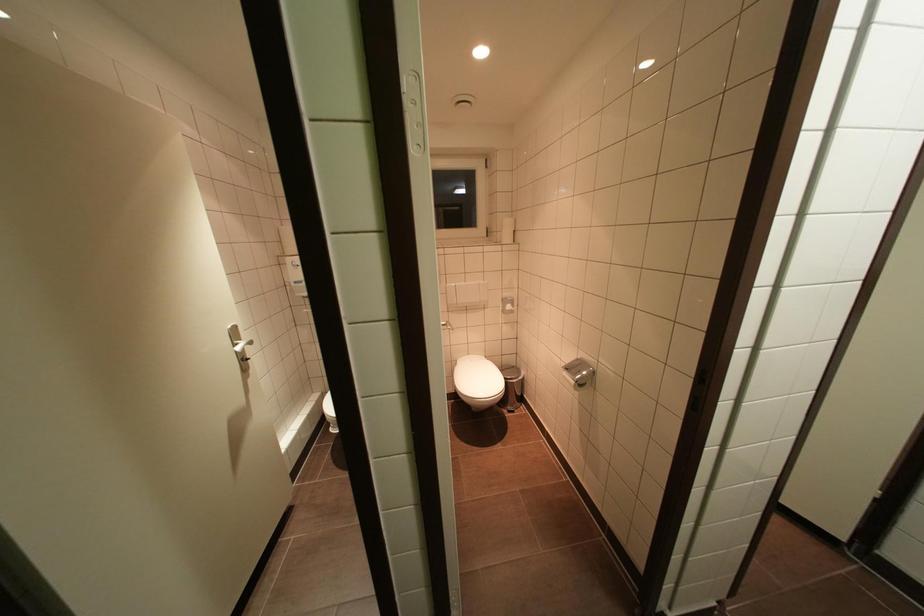
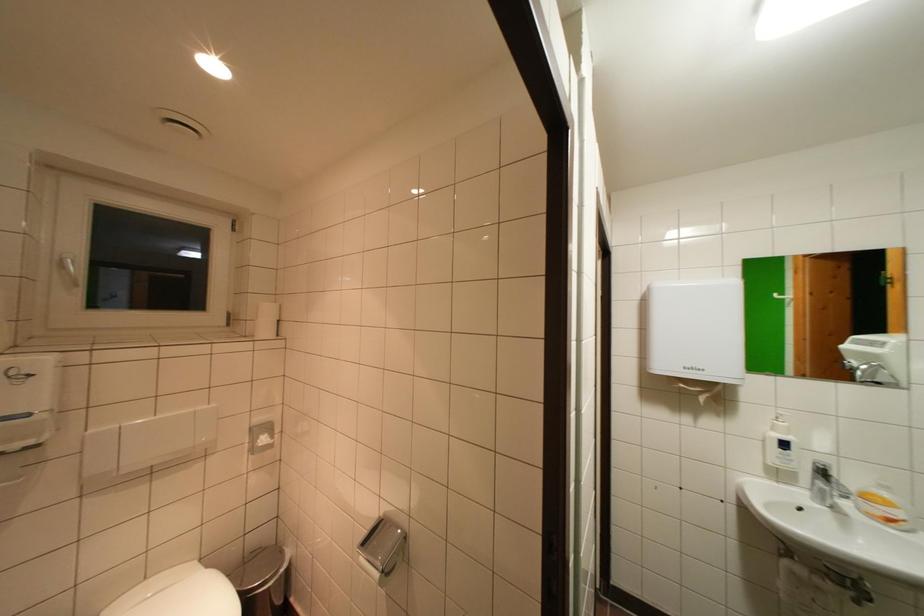
Question: I am providing you with two images of the same scene from different viewpoints. After the viewpoint changes to image2, which objects are now occluded?

Choices:
 (A) roll of toilet paper
 (B) white door handle
 (C) white toilet lid
 (D) none of these

Answer: (D)